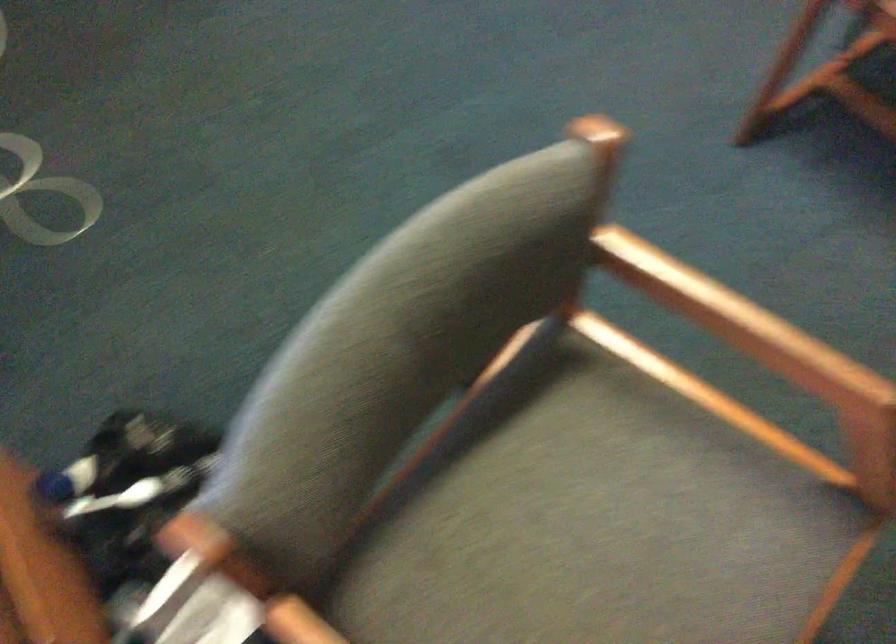
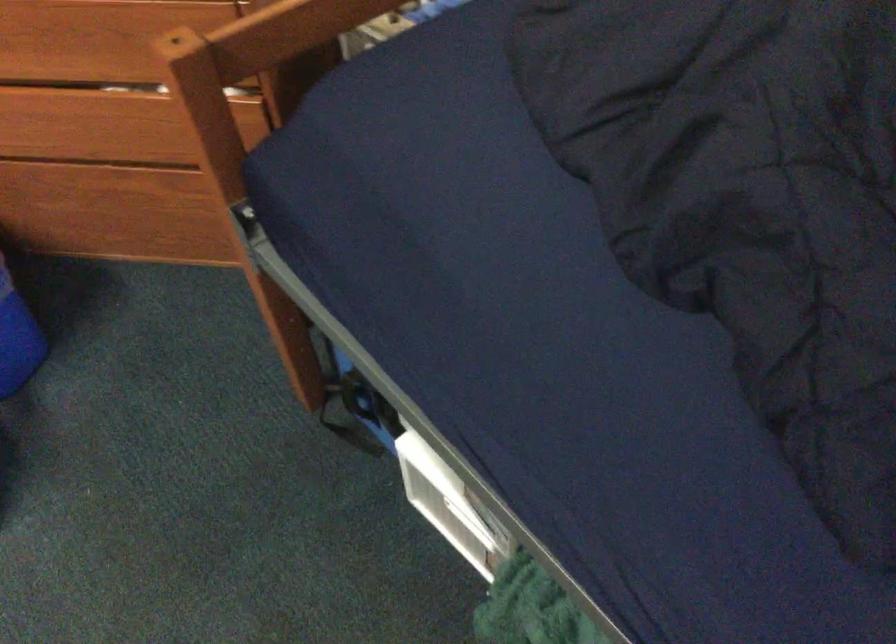
First-person continuous shooting, in which direction is the camera rotating?

The camera's rotation is toward right-down.